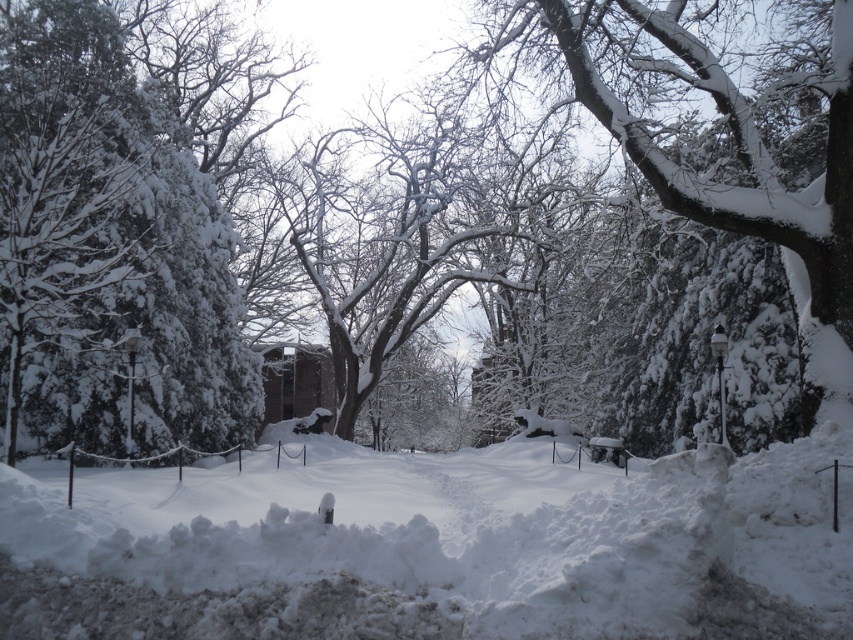
Question: Which point is farther from the camera taking this photo?

Choices:
 (A) (844, 364)
 (B) (135, 490)

Answer: (A)

Question: Among these points, which one is farthest from the camera?

Choices:
 (A) (606, 109)
 (B) (815, 476)

Answer: (A)

Question: Does white fluffy snow at center appear over snow-covered tree at upper right?

Choices:
 (A) yes
 (B) no

Answer: (B)

Question: Does white fluffy snow at center come in front of snow-covered tree at upper right?

Choices:
 (A) no
 (B) yes

Answer: (B)

Question: Can you confirm if white fluffy snow at center is smaller than snow-covered tree at upper right?

Choices:
 (A) no
 (B) yes

Answer: (B)